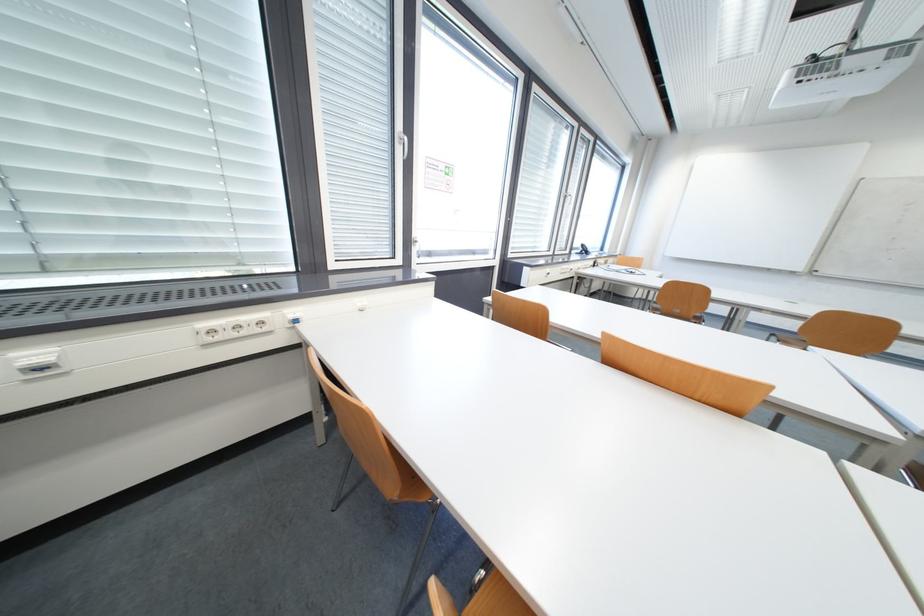
What do you see at coordinates (234, 329) in the screenshot? I see `the white power outlet` at bounding box center [234, 329].